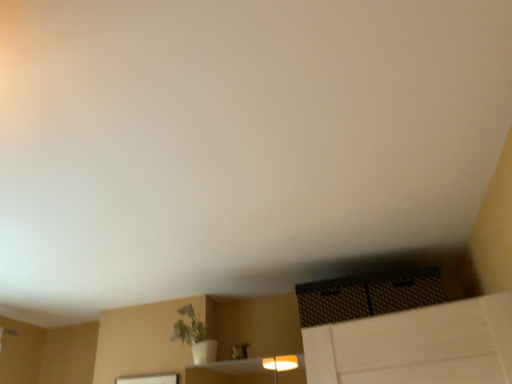
The width and height of the screenshot is (512, 384). I want to click on brown woven cabinet at upper right, so click(x=368, y=295).

The width and height of the screenshot is (512, 384). What do you see at coordinates (368, 295) in the screenshot?
I see `brown woven cabinet at upper right` at bounding box center [368, 295].

The height and width of the screenshot is (384, 512). In order to click on brown woven cabinet at upper right in this screenshot , I will do `click(368, 295)`.